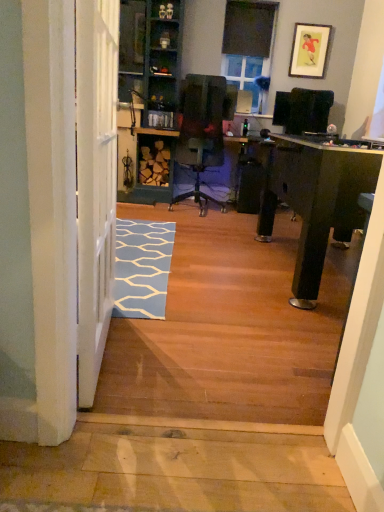
Measure the distance between point (257, 47) and camera.

They are 5.02 meters apart.

What do you see at coordinates (248, 28) in the screenshot?
I see `black matte window screen at upper center, the second window screen when ordered from back to front` at bounding box center [248, 28].

The width and height of the screenshot is (384, 512). Identify the location of matte gold picture frame at upper right. (309, 50).

Image resolution: width=384 pixels, height=512 pixels. What are the coordinates of `clear glass window screen at upper center, the second window screen positioned from the top` in the screenshot? It's located at (244, 74).

Considering the relative positions of black matte window screen at upper center, which is the 2th window screen in bottom-to-top order, and green painted wood bookshelf at center in the image provided, is black matte window screen at upper center, which is the 2th window screen in bottom-to-top order, to the left of green painted wood bookshelf at center from the viewer's perspective?

No.

Is black matte window screen at upper center, the second window screen when ordered from back to front, bigger than green painted wood bookshelf at center?

Actually, black matte window screen at upper center, the second window screen when ordered from back to front, might be smaller than green painted wood bookshelf at center.

From the image's perspective, which one is positioned higher, black matte window screen at upper center, arranged as the first window screen when viewed from the top, or green painted wood bookshelf at center?

black matte window screen at upper center, arranged as the first window screen when viewed from the top, from the image's perspective.

Does black matte window screen at upper center, which is the 2th window screen in bottom-to-top order, turn towards matte gold picture frame at upper right?

No.

From a real-world perspective, which is physically above, black matte window screen at upper center, the first window screen positioned from the front, or matte gold picture frame at upper right?

From a 3D spatial view, black matte window screen at upper center, the first window screen positioned from the front, is above.

Between black matte window screen at upper center, the second window screen when ordered from back to front, and matte gold picture frame at upper right, which one appears on the right side from the viewer's perspective?

From the viewer's perspective, matte gold picture frame at upper right appears more on the right side.

Is clear glass window screen at upper center, the second window screen positioned from the top, facing towards black matte window screen at upper center, which is the 2th window screen in bottom-to-top order?

No, clear glass window screen at upper center, the second window screen positioned from the top, is not facing towards black matte window screen at upper center, which is the 2th window screen in bottom-to-top order.

Considering the positions of objects clear glass window screen at upper center, which ranks as the 2th window screen in front-to-back order, and black matte window screen at upper center, the first window screen positioned from the front, in the image provided, who is in front, clear glass window screen at upper center, which ranks as the 2th window screen in front-to-back order, or black matte window screen at upper center, the first window screen positioned from the front,?

Positioned in front is black matte window screen at upper center, the first window screen positioned from the front.

Between clear glass window screen at upper center, the second window screen positioned from the top, and black matte window screen at upper center, arranged as the first window screen when viewed from the top, which one has smaller width?

black matte window screen at upper center, arranged as the first window screen when viewed from the top, is thinner.

Considering the positions of objects black matte window screen at upper center, arranged as the first window screen when viewed from the top, and clear glass window screen at upper center, the 1th window screen positioned from the back, in the image provided, who is more to the left, black matte window screen at upper center, arranged as the first window screen when viewed from the top, or clear glass window screen at upper center, the 1th window screen positioned from the back,?

clear glass window screen at upper center, the 1th window screen positioned from the back, is more to the left.

Is black matte window screen at upper center, the second window screen when ordered from back to front, oriented away from clear glass window screen at upper center, the 1th window screen positioned from the back?

No, clear glass window screen at upper center, the 1th window screen positioned from the back, is not at the back of black matte window screen at upper center, the second window screen when ordered from back to front.

Which of these two, black matte window screen at upper center, the first window screen positioned from the front, or clear glass window screen at upper center, the 1th window screen positioned from the back, is bigger?

clear glass window screen at upper center, the 1th window screen positioned from the back, is bigger.

Which is more to the right, matte gold picture frame at upper right or blue carpet at lower left?

From the viewer's perspective, matte gold picture frame at upper right appears more on the right side.

Considering the points (322, 42) and (233, 306), which point is in front, point (322, 42) or point (233, 306)?

The point (233, 306) is closer to the camera.

Considering the relative sizes of matte gold picture frame at upper right and blue carpet at lower left in the image provided, is matte gold picture frame at upper right thinner than blue carpet at lower left?

Correct, the width of matte gold picture frame at upper right is less than that of blue carpet at lower left.

From a real-world perspective, is matte gold picture frame at upper right physically located above or below blue carpet at lower left?

Clearly, from a real-world perspective, matte gold picture frame at upper right is above blue carpet at lower left.

The image size is (384, 512). Find the location of `window screen that is the 2nd one when counting backward from the green painted wood bookshelf at center`. window screen that is the 2nd one when counting backward from the green painted wood bookshelf at center is located at coordinates (244, 74).

From a real-world perspective, does green painted wood bookshelf at center stand above clear glass window screen at upper center, the 1th window screen positioned from the back?

Incorrect, from a real-world perspective, green painted wood bookshelf at center is lower than clear glass window screen at upper center, the 1th window screen positioned from the back.

Considering the relative positions of green painted wood bookshelf at center and clear glass window screen at upper center, which ranks as the 2th window screen in front-to-back order, in the image provided, is green painted wood bookshelf at center in front of clear glass window screen at upper center, which ranks as the 2th window screen in front-to-back order,?

That is True.

Is green painted wood bookshelf at center oriented towards clear glass window screen at upper center, which ranks as the 2th window screen in front-to-back order?

No, green painted wood bookshelf at center is not aimed at clear glass window screen at upper center, which ranks as the 2th window screen in front-to-back order.

Is blue carpet at lower left at the right side of matte gold picture frame at upper right?

No, blue carpet at lower left is not to the right of matte gold picture frame at upper right.

Is blue carpet at lower left oriented towards matte gold picture frame at upper right?

No, blue carpet at lower left does not turn towards matte gold picture frame at upper right.

Is blue carpet at lower left smaller than matte gold picture frame at upper right?

No.

Which is closer, [274,381] or [290,57]?

Point [274,381] appears to be closer to the viewer than point [290,57].

Find the location of `bookshelf that appears below the black matte window screen at upper center, the second window screen when ordered from back to front (from the image's perspective)`. bookshelf that appears below the black matte window screen at upper center, the second window screen when ordered from back to front (from the image's perspective) is located at coordinates (149, 96).

At what (x,y) coordinates should I click in order to perform the action: click on the 1st window screen to the left when counting from the matte gold picture frame at upper right. Please return your answer as a coordinate pair (x, y). Image resolution: width=384 pixels, height=512 pixels. Looking at the image, I should click on (248, 28).

From the image, which object appears to be farther from matte gold picture frame at upper right, black matte window screen at upper center, arranged as the first window screen when viewed from the top, or green painted wood bookshelf at center?

Based on the image, green painted wood bookshelf at center appears to be further to matte gold picture frame at upper right.

Which object lies nearer to the anchor point clear glass window screen at upper center, which ranks as the 2th window screen in front-to-back order, green painted wood bookshelf at center or black matte window screen at upper center, which is the 2th window screen in bottom-to-top order?

black matte window screen at upper center, which is the 2th window screen in bottom-to-top order, is closer to clear glass window screen at upper center, which ranks as the 2th window screen in front-to-back order.

Looking at the image, which one is located closer to green painted wood bookshelf at center, blue carpet at lower left or clear glass window screen at upper center, the second window screen positioned from the top?

Among the two, clear glass window screen at upper center, the second window screen positioned from the top, is located nearer to green painted wood bookshelf at center.

Considering their positions, is black matte window screen at upper center, which is the 2th window screen in bottom-to-top order, positioned further to blue carpet at lower left than green painted wood bookshelf at center?

black matte window screen at upper center, which is the 2th window screen in bottom-to-top order, is further to blue carpet at lower left.

Considering their positions, is green painted wood bookshelf at center positioned further to matte gold picture frame at upper right than black matte window screen at upper center, arranged as the first window screen when viewed from the top?

Among the two, green painted wood bookshelf at center is located further to matte gold picture frame at upper right.

Looking at the image, which one is located further to clear glass window screen at upper center, the 1th window screen positioned from the back, blue carpet at lower left or black matte window screen at upper center, the second window screen when ordered from back to front?

blue carpet at lower left is further to clear glass window screen at upper center, the 1th window screen positioned from the back.

Based on their spatial positions, is matte gold picture frame at upper right or black matte window screen at upper center, arranged as the first window screen when viewed from the top, further from blue carpet at lower left?

black matte window screen at upper center, arranged as the first window screen when viewed from the top, is further to blue carpet at lower left.

Estimate the real-world distances between objects in this image. Which object is further from blue carpet at lower left, green painted wood bookshelf at center or clear glass window screen at upper center, which ranks as the 2th window screen in front-to-back order?

clear glass window screen at upper center, which ranks as the 2th window screen in front-to-back order, is further to blue carpet at lower left.

Where is `bookshelf between blue carpet at lower left and matte gold picture frame at upper right along the z-axis`? The width and height of the screenshot is (384, 512). bookshelf between blue carpet at lower left and matte gold picture frame at upper right along the z-axis is located at coordinates (149, 96).

You are a GUI agent. You are given a task and a screenshot of the screen. Output one action in this format:
    pyautogui.click(x=<x>, y=<y>)
    Task: Click on the window screen situated between green painted wood bookshelf at center and black matte window screen at upper center, the second window screen when ordered from back to front, from left to right
    The height and width of the screenshot is (512, 384).
    Given the screenshot: What is the action you would take?
    pyautogui.click(x=244, y=74)

Identify the location of bookshelf between blue carpet at lower left and clear glass window screen at upper center, which ranks as the 2th window screen in front-to-back order, along the z-axis. (149, 96).

At what (x,y) coordinates should I click in order to perform the action: click on picture frame located between blue carpet at lower left and black matte window screen at upper center, the second window screen when ordered from back to front, in the depth direction. Please return your answer as a coordinate pair (x, y). The image size is (384, 512). Looking at the image, I should click on (309, 50).